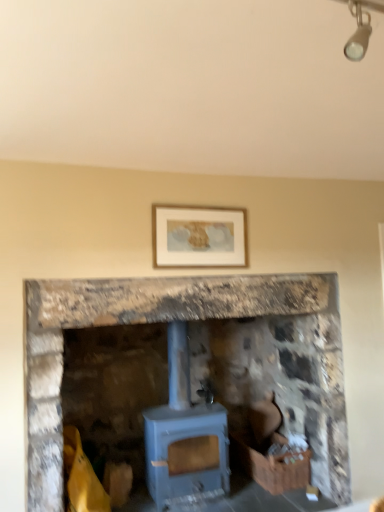
Where is `vacant space in front of wooden crate at lower right`? Image resolution: width=384 pixels, height=512 pixels. vacant space in front of wooden crate at lower right is located at coordinates (285, 499).